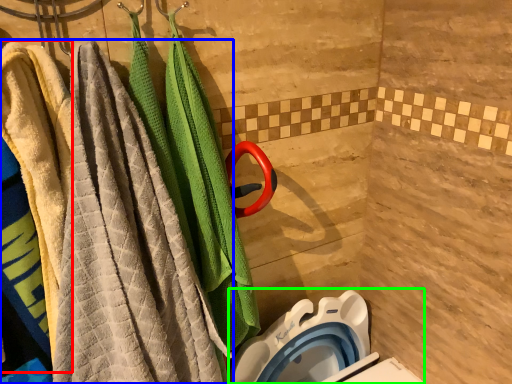
Question: Based on their relative distances, which object is nearer to beach towel (highlighted by a red box)? Choose from towel (highlighted by a blue box) and toilet bowl (highlighted by a green box).

Choices:
 (A) towel
 (B) toilet bowl

Answer: (A)